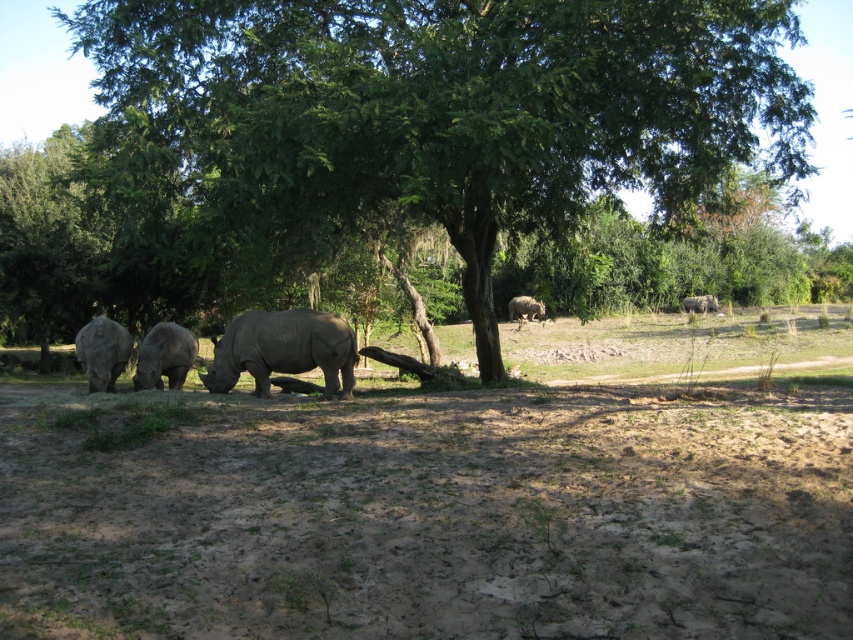
Is brown sandy dirt at lower center to the right of matte gray rhinoceros at left from the viewer's perspective?

Indeed, brown sandy dirt at lower center is positioned on the right side of matte gray rhinoceros at left.

Identify the location of brown sandy dirt at lower center. The width and height of the screenshot is (853, 640). (426, 515).

Where is `brown sandy dirt at lower center`? brown sandy dirt at lower center is located at coordinates (426, 515).

Locate an element on the screen. Image resolution: width=853 pixels, height=640 pixels. brown sandy dirt at lower center is located at coordinates (426, 515).

Describe the element at coordinates (283, 349) in the screenshot. This screenshot has width=853, height=640. I see `gray matte rhinoceros at center` at that location.

Does gray matte rhinoceros at center have a greater width compared to matte gray rhinoceros at center?

In fact, gray matte rhinoceros at center might be narrower than matte gray rhinoceros at center.

Who is more forward, (207, 390) or (535, 316)?

Point (207, 390) is more forward.

Where is `gray matte rhinoceros at center`? The image size is (853, 640). gray matte rhinoceros at center is located at coordinates (283, 349).

Between matte gray rhinoceros at center and matte gray rhinoceros at upper right, which one has more height?

matte gray rhinoceros at center

Which is above, matte gray rhinoceros at center or matte gray rhinoceros at upper right?

matte gray rhinoceros at upper right is above.

Find the location of a particular element. matte gray rhinoceros at center is located at coordinates 525,308.